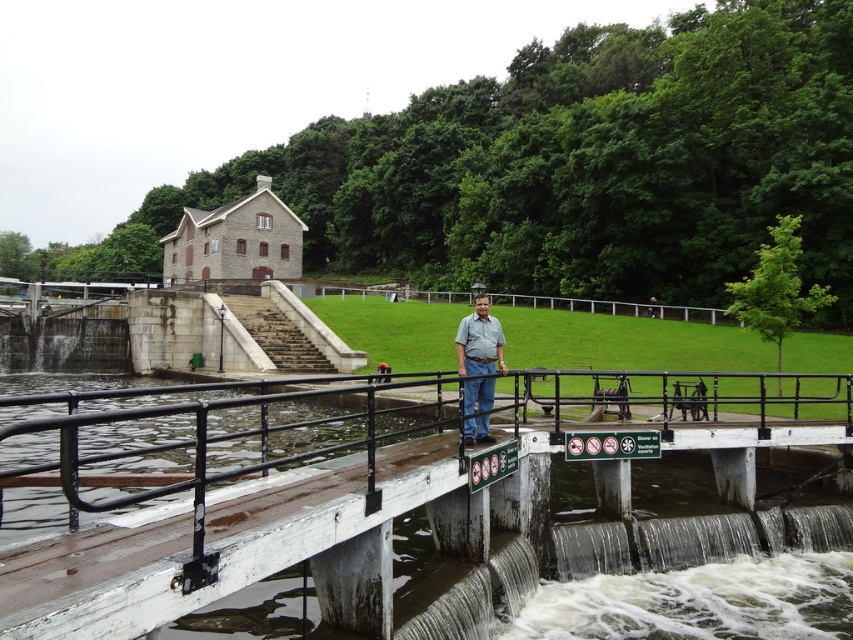
You are a photographer trying to capture a shot of the green fabric shirt at center and the white painted wood rail at center. If you want to ensure both objects are fully visible in your frame, which object requires more horizontal space in the composition?

The white painted wood rail at center requires more horizontal space in the composition because its width is larger than the green fabric shirt at center.